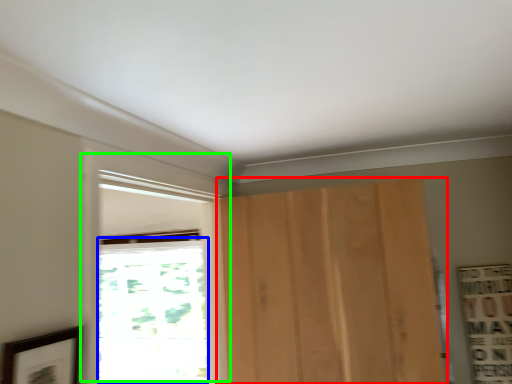
Question: Considering the real-world distances, which object is farthest from door (highlighted by a red box)? window (highlighted by a blue box) or window (highlighted by a green box)?

Choices:
 (A) window
 (B) window

Answer: (A)